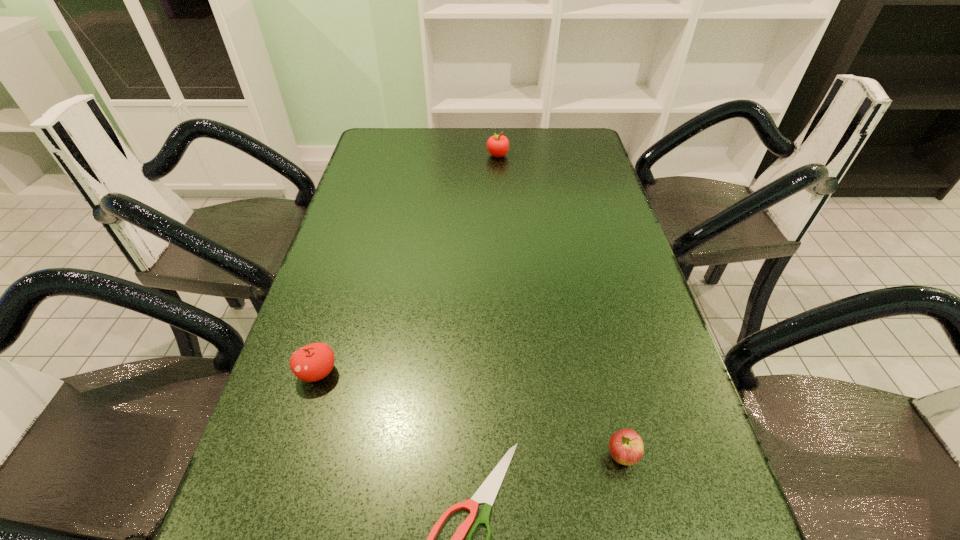
Where is `the farthest object`? This screenshot has height=540, width=960. the farthest object is located at coordinates (497, 145).

What are the coordinates of `the farthest apple` in the screenshot? It's located at (497, 145).

At what (x,y) coordinates should I click in order to perform the action: click on the nearest apple. Please return your answer as a coordinate pair (x, y). This screenshot has height=540, width=960. Looking at the image, I should click on (626, 447).

Locate an element on the screen. Image resolution: width=960 pixels, height=540 pixels. the rightmost apple is located at coordinates (626, 447).

At what (x,y) coordinates should I click in order to perform the action: click on the second farthest apple. Please return your answer as a coordinate pair (x, y). Looking at the image, I should click on (313, 362).

Where is `the second farthest object`? The height and width of the screenshot is (540, 960). the second farthest object is located at coordinates (313, 362).

Locate an element on the screen. This screenshot has height=540, width=960. free region located on the back of the second apple from left to right is located at coordinates (496, 128).

The width and height of the screenshot is (960, 540). I want to click on vacant area located on the back of the nearest apple, so click(x=591, y=323).

I want to click on free space located on the back of the leftmost object, so [350, 264].

The width and height of the screenshot is (960, 540). In order to click on object situated at the far edge in this screenshot , I will do `click(497, 145)`.